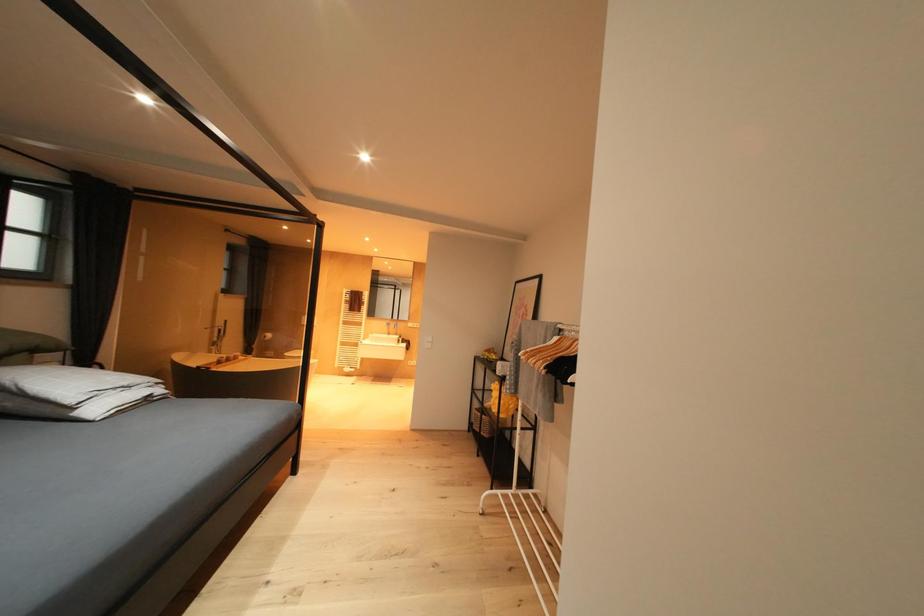
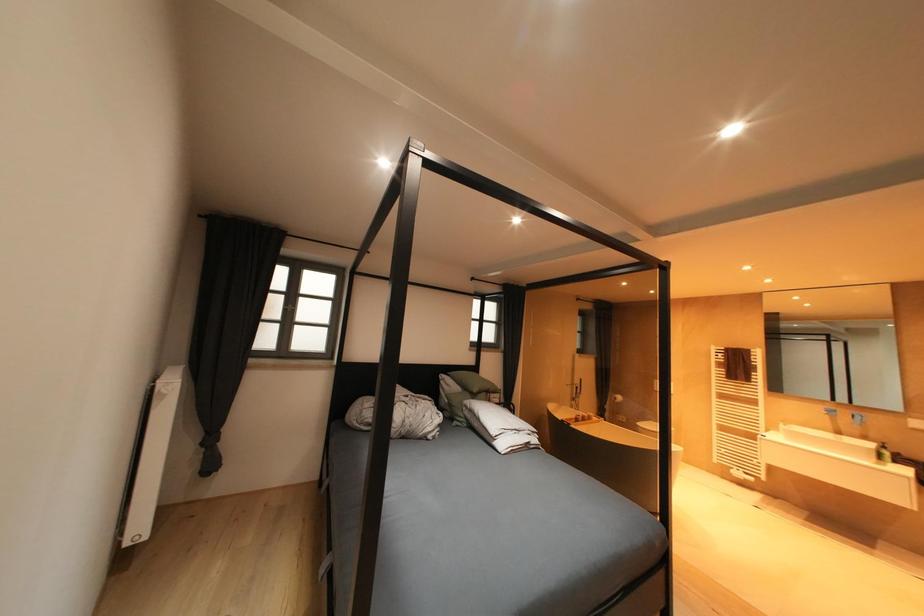
Question: Based on the continuous images, in which direction is the camera rotating? Reply with the corresponding letter.

Choices:
 (A) Left
 (B) Right
 (C) Up
 (D) Down

Answer: (A)